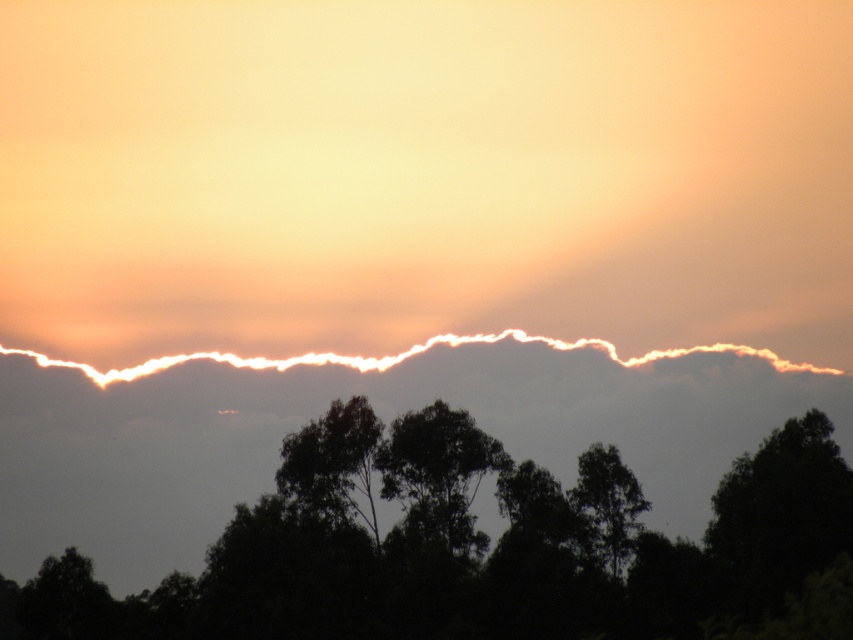
Does white fluffy cloud at upper center have a lesser width compared to dark green leafy tree at center?

Incorrect, white fluffy cloud at upper center's width is not less than dark green leafy tree at center's.

This screenshot has height=640, width=853. Describe the element at coordinates (378, 413) in the screenshot. I see `white fluffy cloud at upper center` at that location.

You are a GUI agent. You are given a task and a screenshot of the screen. Output one action in this format:
    pyautogui.click(x=<x>, y=<y>)
    Task: Click on the white fluffy cloud at upper center
    The width and height of the screenshot is (853, 640).
    Given the screenshot: What is the action you would take?
    pyautogui.click(x=378, y=413)

Can you confirm if silhouette leafy tree at center is bigger than dark green leafy tree at center?

Indeed, silhouette leafy tree at center has a larger size compared to dark green leafy tree at center.

Does point (477, 456) come closer to viewer compared to point (608, 474)?

That is False.

Where is `silhouette leafy tree at center`? This screenshot has width=853, height=640. silhouette leafy tree at center is located at coordinates (439, 474).

Image resolution: width=853 pixels, height=640 pixels. What do you see at coordinates (439, 474) in the screenshot? I see `silhouette leafy tree at center` at bounding box center [439, 474].

I want to click on silhouette leafy tree at center, so click(x=439, y=474).

I want to click on silhouette leafy tree at center, so click(x=439, y=474).